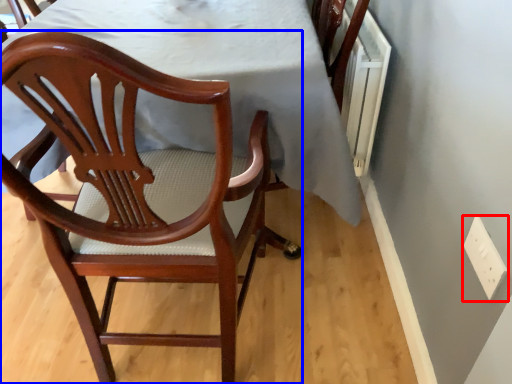
Question: Among these objects, which one is farthest to the camera, electric outlet (highlighted by a red box) or chair (highlighted by a blue box)?

Choices:
 (A) electric outlet
 (B) chair

Answer: (A)